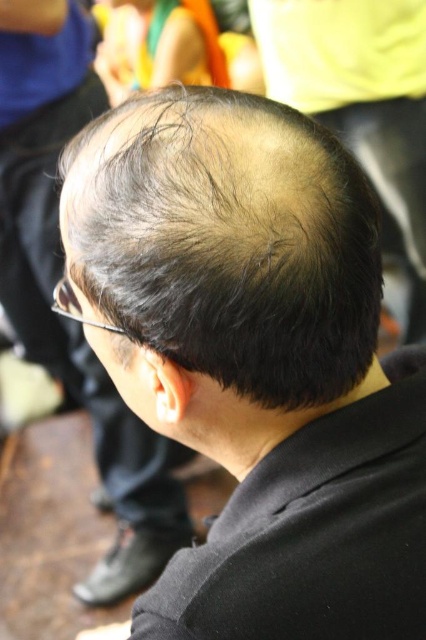
Question: Considering the relative positions of dark brown hair at center and dark brown hair at upper center in the image provided, where is dark brown hair at center located with respect to dark brown hair at upper center?

Choices:
 (A) right
 (B) left

Answer: (A)

Question: Does dark brown hair at center appear under dark brown hair at upper center?

Choices:
 (A) yes
 (B) no

Answer: (A)

Question: Is dark brown hair at center further to camera compared to dark brown hair at upper center?

Choices:
 (A) no
 (B) yes

Answer: (A)

Question: Which object is farther from the camera taking this photo?

Choices:
 (A) dark brown hair at center
 (B) dark brown hair at upper center

Answer: (B)

Question: Among these points, which one is nearest to the camera?

Choices:
 (A) (322, 288)
 (B) (40, 134)

Answer: (A)